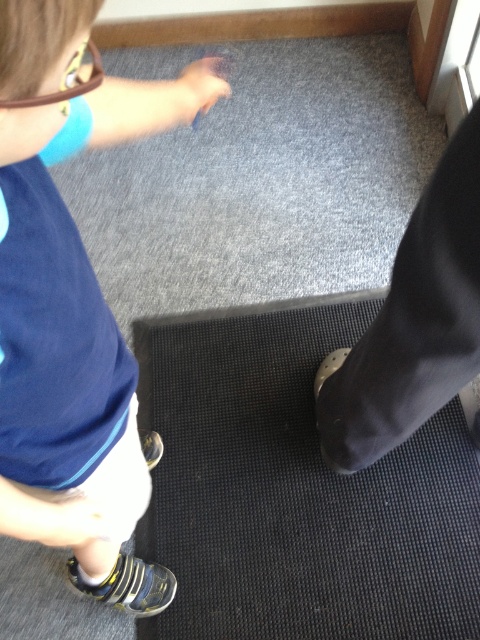
Question: Among these points, which one is farthest from the camera?

Choices:
 (A) (228, 602)
 (B) (41, 36)

Answer: (A)

Question: Among these points, which one is nearest to the camera?

Choices:
 (A) (228, 348)
 (B) (46, 136)

Answer: (B)

Question: Does black rubber mat at lower center appear on the right side of blue fabric shirt at upper left?

Choices:
 (A) no
 (B) yes

Answer: (B)

Question: Does black rubber mat at lower center appear on the right side of blue fabric shirt at upper left?

Choices:
 (A) yes
 (B) no

Answer: (A)

Question: Is black rubber mat at lower center below blue fabric shirt at upper left?

Choices:
 (A) yes
 (B) no

Answer: (A)